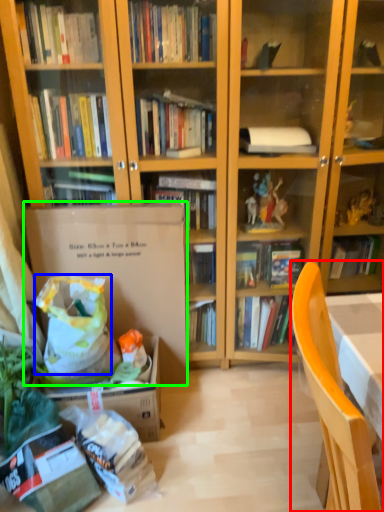
Question: Estimate the real-world distances between objects in this image. Which object is closer to chair (highlighted by a red box), grocery bag (highlighted by a blue box) or paperback book (highlighted by a green box)?

Choices:
 (A) grocery bag
 (B) paperback book

Answer: (A)